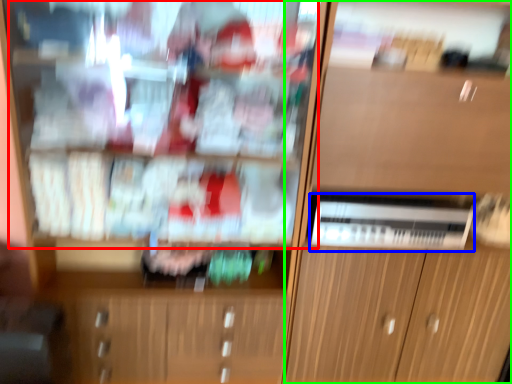
Question: Considering the real-world distances, which object is closest to shelf (highlighted by a red box)? appliance (highlighted by a blue box) or cabinetry (highlighted by a green box).

Choices:
 (A) appliance
 (B) cabinetry

Answer: (B)